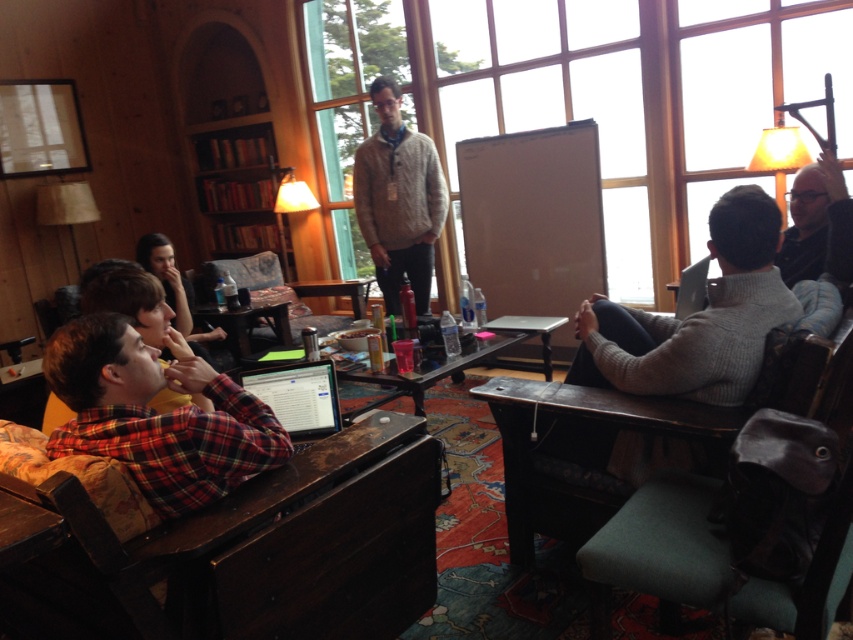
Consider the image. You are organizing a small event in this room and need to place a 1.2 meter wide banner between the red plaid shirt at lower left and the metallic silver table at center. Will the space between them be sufficient to accommodate the banner?

The red plaid shirt at lower left is smaller than the metallic silver table at center, but the spatial relationship between their positions isn not specified in the objects description. Therefore, it is unclear if the space between them can fit the 1.2 meter wide banner.

You are sitting at the metallic silver table at center and want to hand a document to the person wearing the red plaid shirt at lower left. Can you reach them without leaving your seat?

The red plaid shirt at lower left is above the metallic silver table at center, so you can reach them by extending your arm upwards.